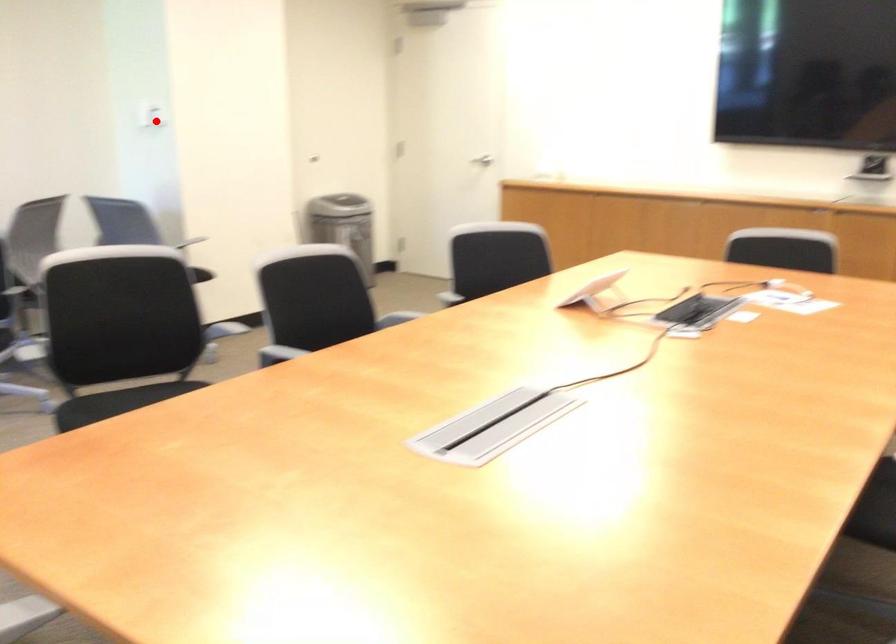
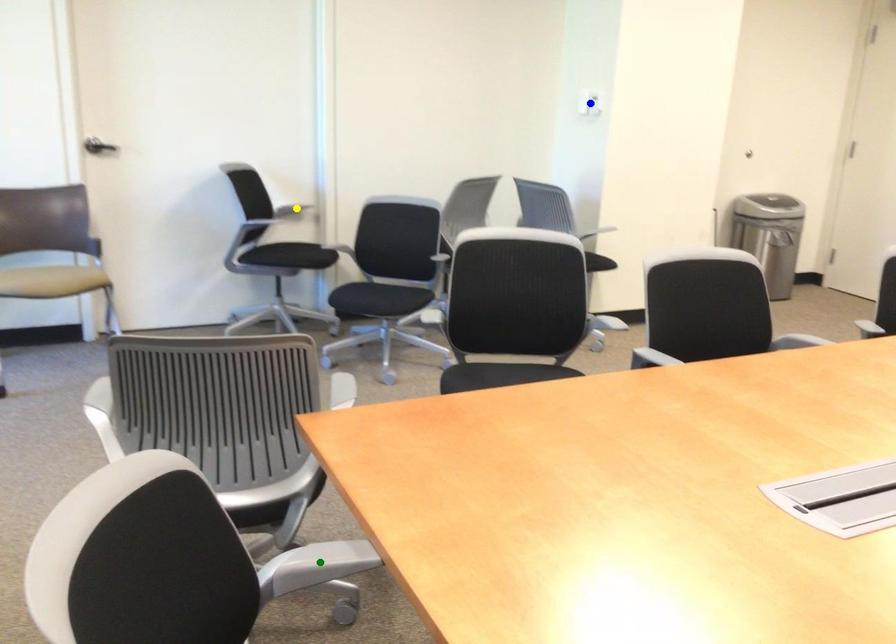
Question: I am providing you with two images of the same scene from different viewpoints. A red point is marked on the first image. You are given multiple points on the second image. In image 2, which mark is for the same physical point as the one in image 1?

Choices:
 (A) blue point
 (B) green point
 (C) yellow point

Answer: (A)